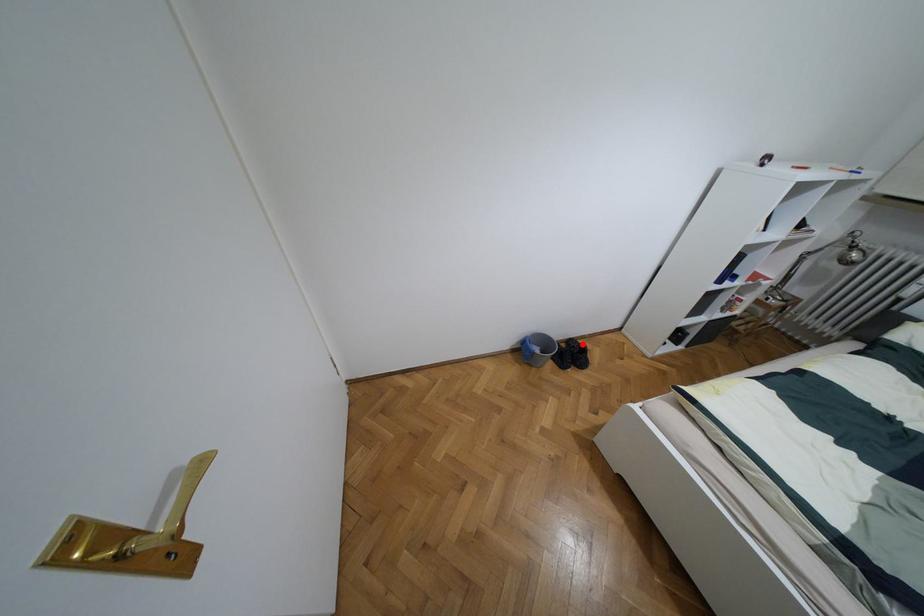
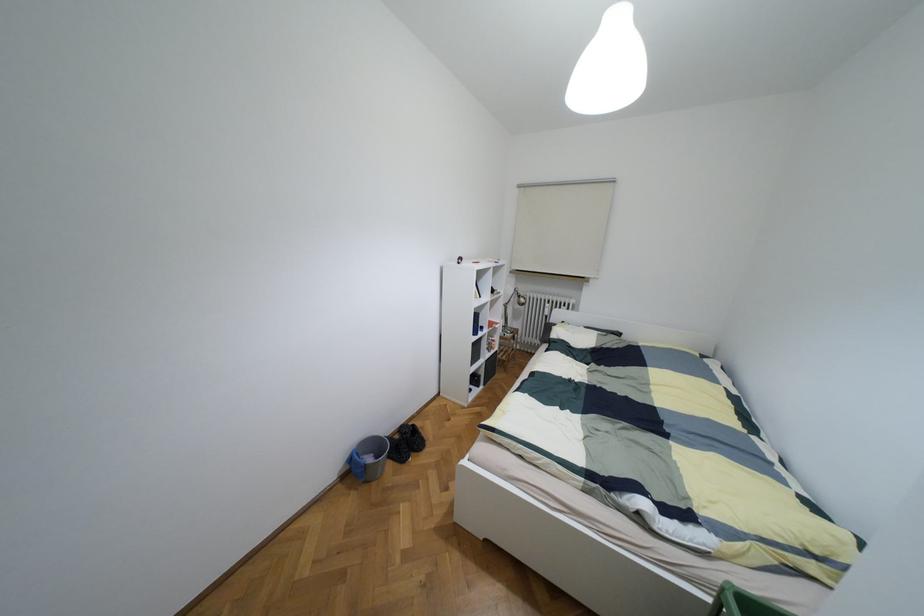
Question: I am providing you with two images of the same scene from different viewpoints. Image1 has a red point marked. In image2, the corresponding 3D location appears at what relative position? Reply with the corresponding letter.

Choices:
 (A) Closer
 (B) Farther

Answer: (A)